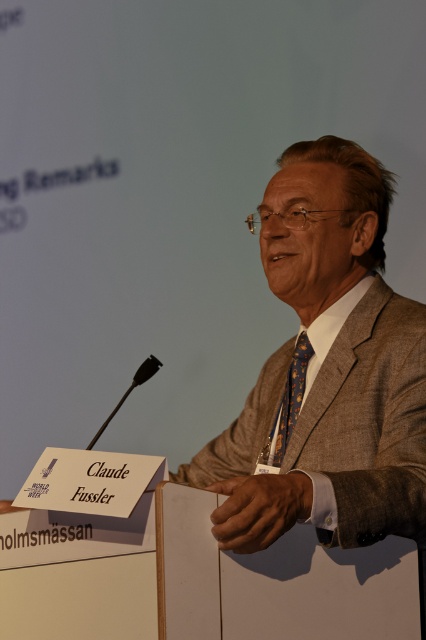
You are a photographer at the event and need to frame the man in a portrait. The camera lens can only accommodate objects up to 1 meter in width. Given that the brown textured suit at center and blue dotted fabric tie at center are both in the frame, can you confirm if the total width of both items combined will fit within the camera lens limit?

The brown textured suit at center might be wider than blue dotted fabric tie at center, but without exact measurements, it is uncertain whether their combined width would exceed the 1 meter limit. Additional information is needed to confirm.